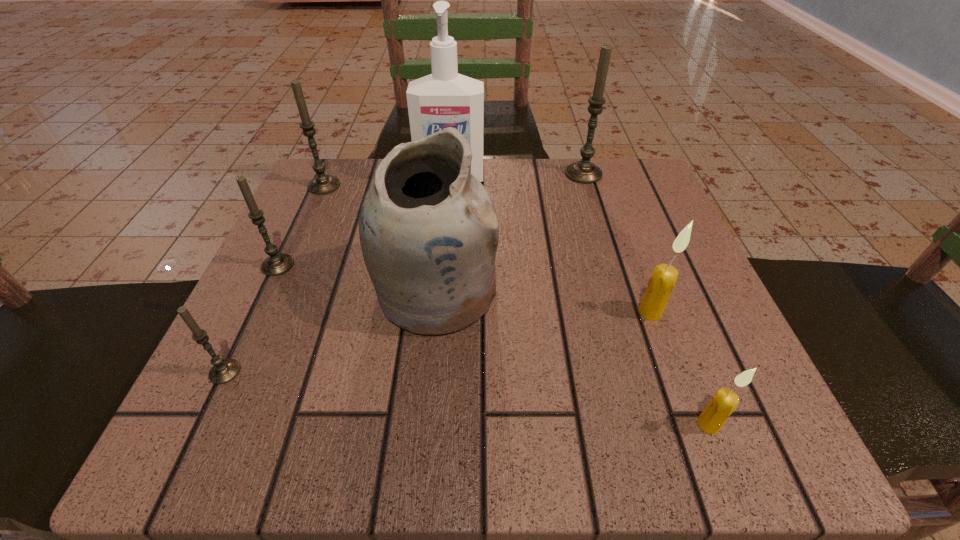
Find the location of `vacant space located on the left of the smaller cream candle`. vacant space located on the left of the smaller cream candle is located at coordinates [579, 424].

Find the location of a particular element. cleansing agent at the far edge is located at coordinates (443, 99).

I want to click on object located at the near edge, so click(x=724, y=402).

What are the coordinates of `object present at the far left corner` in the screenshot? It's located at (322, 184).

At what (x,y) coordinates should I click in order to perform the action: click on object present at the far right corner. Please return your answer as a coordinate pair (x, y). Image resolution: width=960 pixels, height=540 pixels. Looking at the image, I should click on (584, 171).

I want to click on object that is at the near right corner, so click(724, 402).

Image resolution: width=960 pixels, height=540 pixels. Identify the location of free spot at the far edge of the desktop. (532, 204).

The height and width of the screenshot is (540, 960). I want to click on vacant point at the near edge, so click(596, 415).

This screenshot has height=540, width=960. In the image, there is a desktop. Find the location of `vacant space at the left edge`. vacant space at the left edge is located at coordinates point(337,230).

Locate an element on the screen. free space at the right edge of the desktop is located at coordinates pyautogui.click(x=634, y=254).